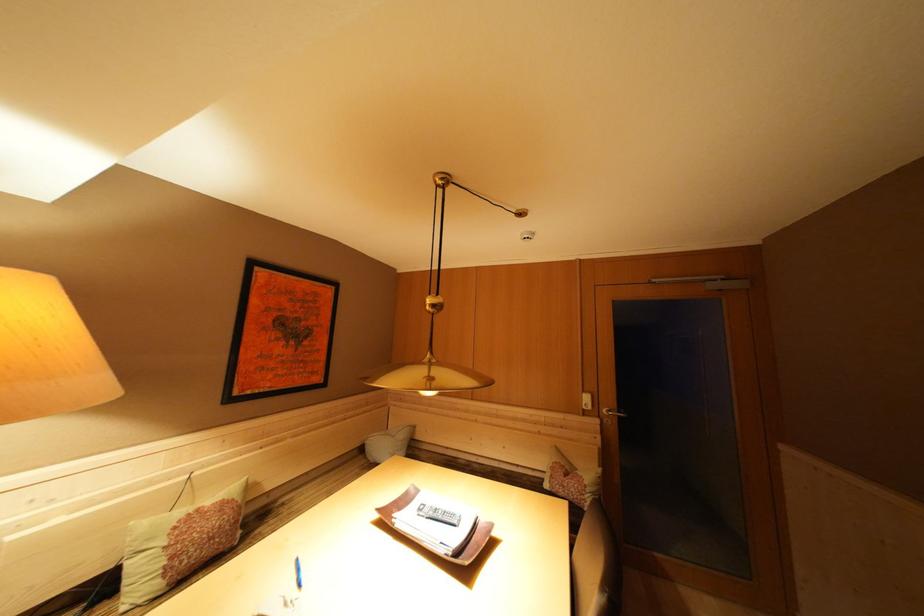
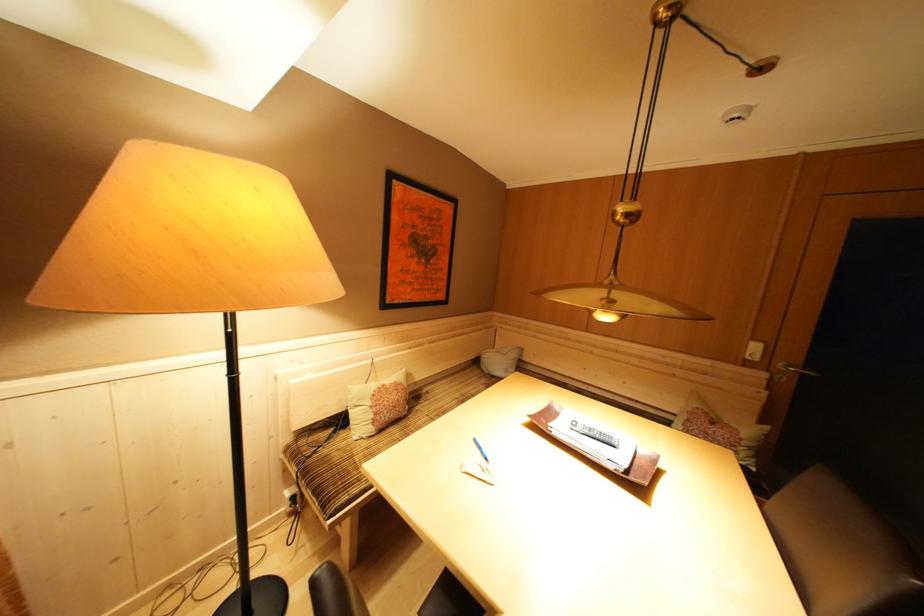
Question: Which direction would the cameraman need to move to produce the second image? Reply with the corresponding letter.

Choices:
 (A) Left
 (B) Right
 (C) Forward
 (D) Backward

Answer: (A)